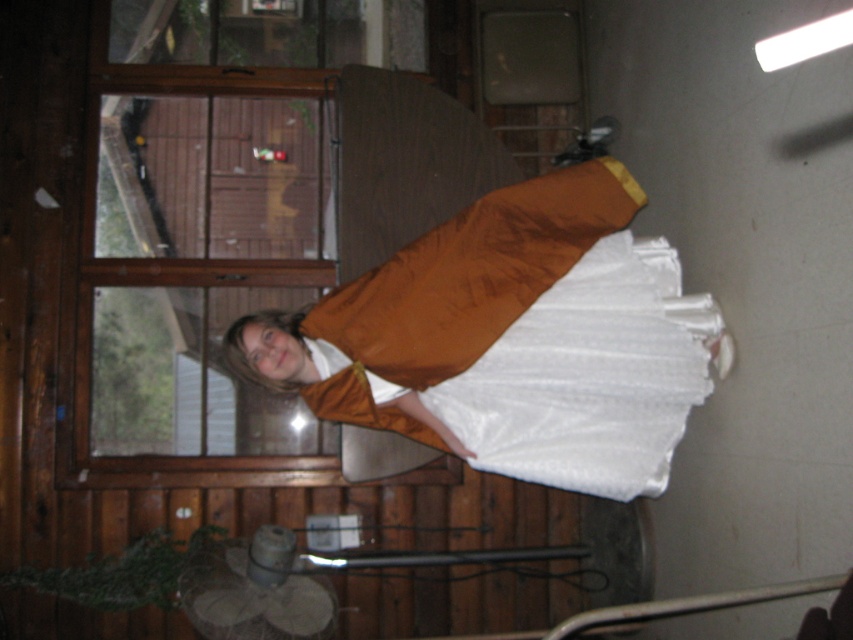
You are standing in the rustic room and want to place a small decoration between the two points, point (608, 486) and point (708, 609). Which point is closer to you so that you can reach it first?

Point (608, 486) is further to the viewer than point (708, 609), so the point closer to you is point (708, 609). You should reach it first.